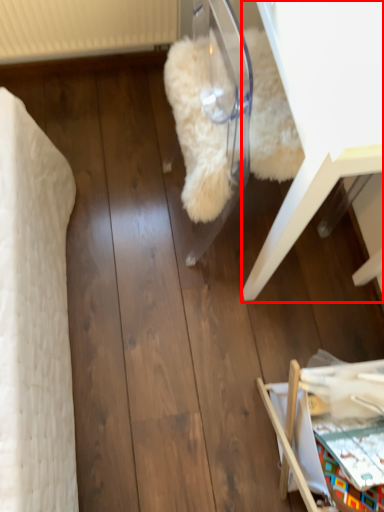
Question: From the image's perspective, where is furniture (annotated by the red box) located in relation to furniture in the image?

Choices:
 (A) above
 (B) below

Answer: (A)